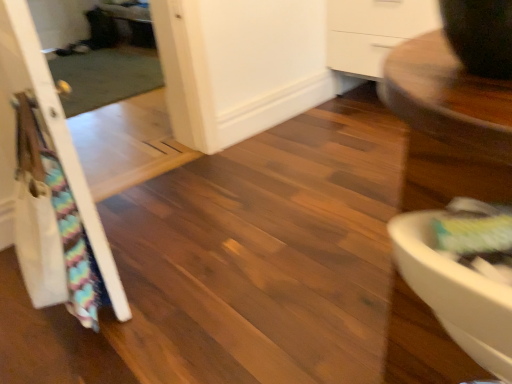
Question: Is point (218, 23) positioned closer to the camera than point (117, 274)?

Choices:
 (A) closer
 (B) farther

Answer: (B)

Question: Relative to white wood door at left, is white matte screen door at center in front or behind?

Choices:
 (A) behind
 (B) front

Answer: (A)

Question: In the image, is white matte screen door at center on the left side or the right side of white wood door at left?

Choices:
 (A) left
 (B) right

Answer: (B)

Question: In the image, is white wood door at left positioned in front of or behind white matte screen door at center?

Choices:
 (A) front
 (B) behind

Answer: (A)

Question: In terms of height, does white wood door at left look taller or shorter compared to white matte screen door at center?

Choices:
 (A) tall
 (B) short

Answer: (A)

Question: From a real-world perspective, relative to white matte screen door at center, is white wood door at left vertically above or below?

Choices:
 (A) below
 (B) above

Answer: (B)

Question: From the image's perspective, is white wood door at left positioned above or below white matte screen door at center?

Choices:
 (A) below
 (B) above

Answer: (A)